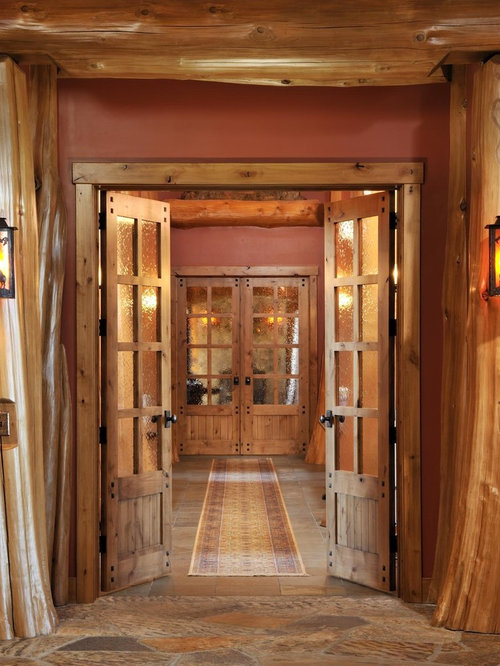
Locate an element on the screen. doors is located at coordinates (155, 480), (373, 486), (227, 411), (269, 411).